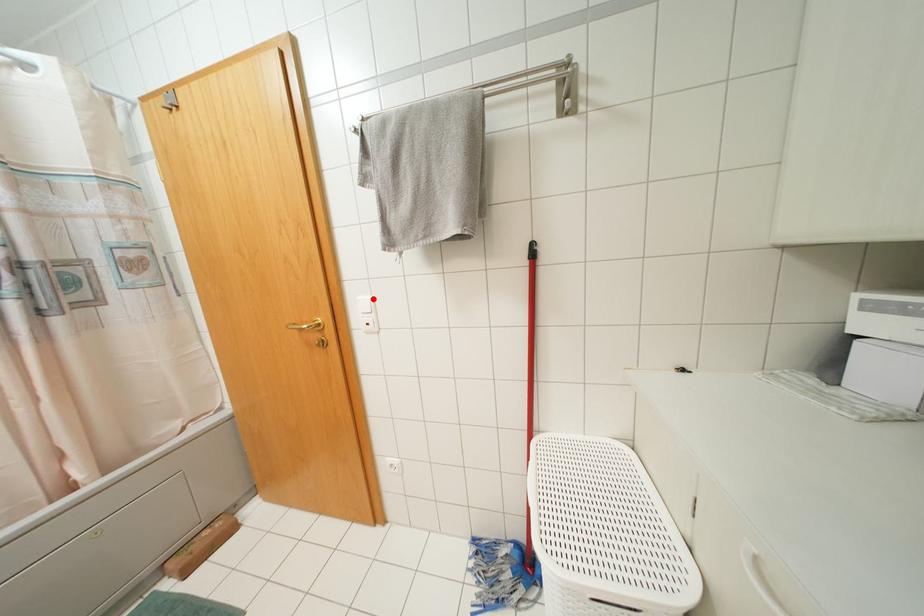
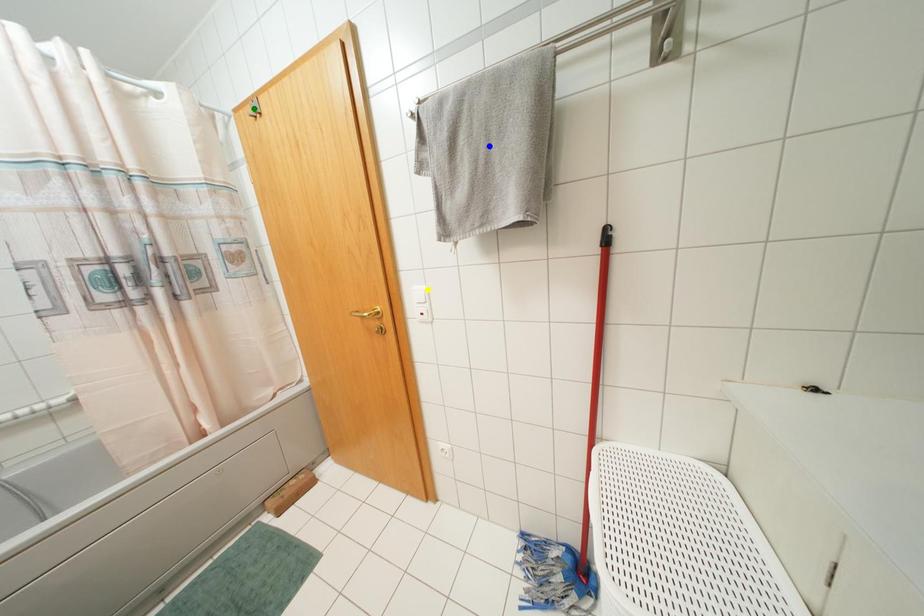
Question: I am providing you with two images of the same scene from different viewpoints. A red point is marked on the first image. You are given multiple points on the second image. Which point in image 2 represents the same 3d spot as the red point in image 1?

Choices:
 (A) blue point
 (B) green point
 (C) yellow point

Answer: (C)